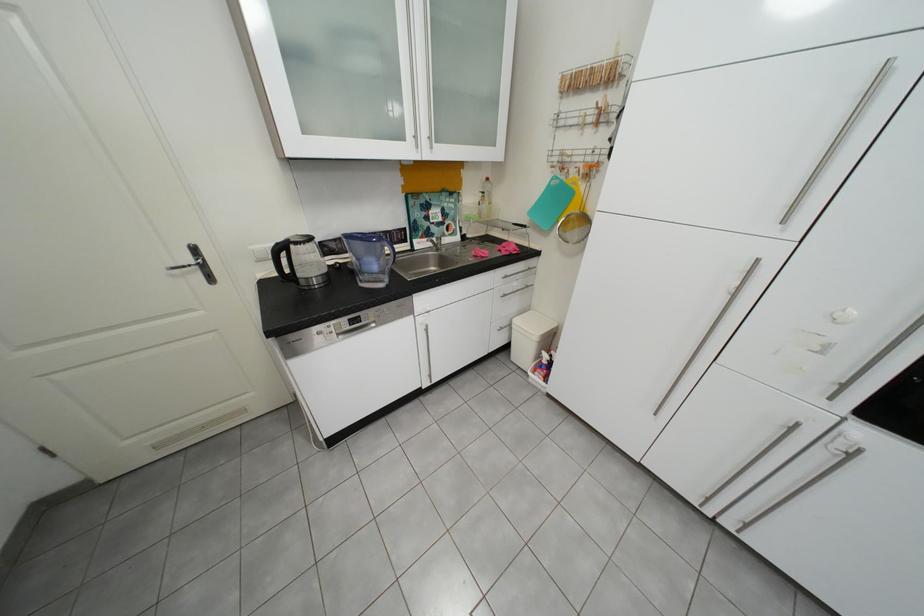
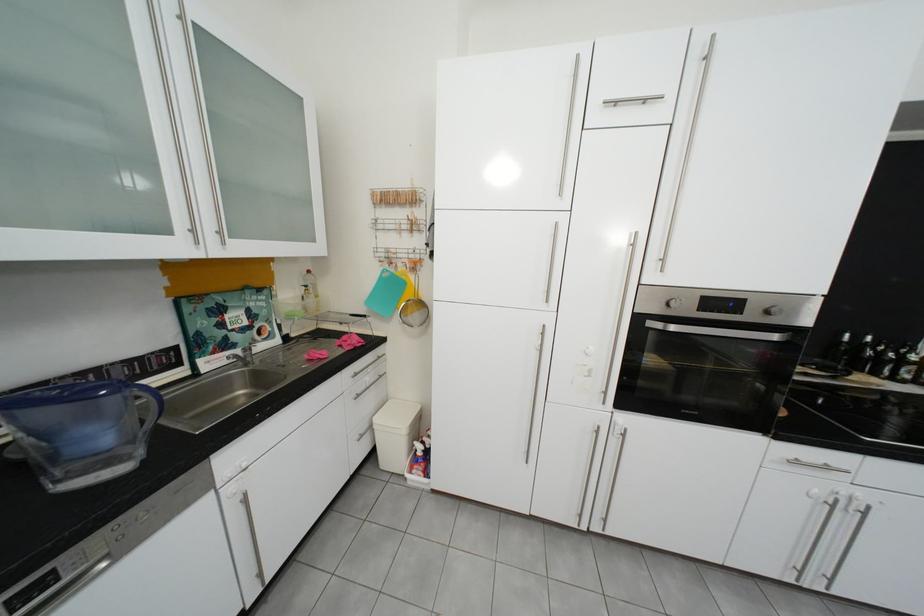
The point at (525, 328) is marked in the first image. Where is the corresponding point in the second image?

(386, 428)